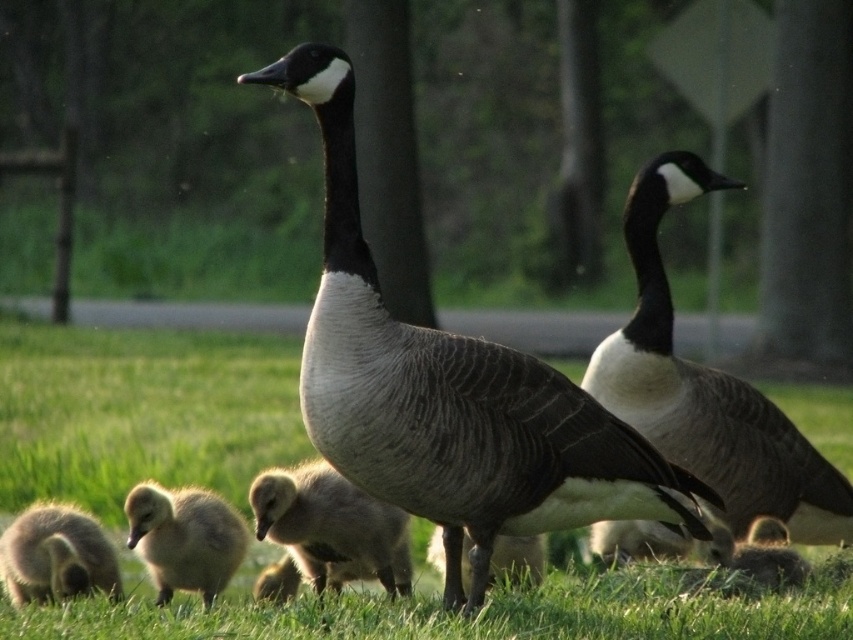
From the picture: You are a birdwatcher trying to take a photo of both the soft yellow duckling at lower left and the soft brown duckling at lower right in the same frame. The camera you are using has a maximum zoom range that can capture objects within a 1.5 meter distance from each other. Can you capture both ducklings in a single photo without moving the camera?

The soft yellow duckling at lower left and the soft brown duckling at lower right are 1.61 meters apart. Since the camera can only capture objects within 1.5 meters of each other, you cannot capture both in a single photo without moving the camera.

You are a photographer trying to capture a closeup of the matte gray goose at center and the soft yellow duckling at lower left in the same frame. Given that your camera has a focal length of 50mm and a sensor size that requires subjects to be within 5 feet to be in focus simultaneously, will you be able to achieve this shot?

The matte gray goose at center and the soft yellow duckling at lower left are 4.83 feet apart, which is within the 5 feet requirement. Therefore, you can capture both in focus simultaneously.

You are a birdwatcher observing the scene. You notice the dark gray feathered goose at center and the soft yellow duckling at lower left. Which of these two has a larger size?

The dark gray feathered goose at center has a larger size compared to the soft yellow duckling at lower left.